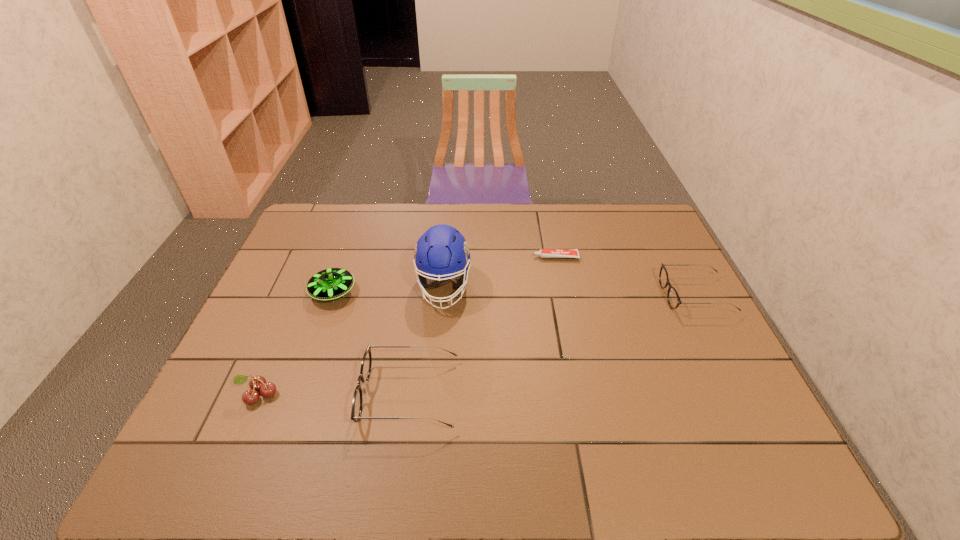
I want to click on spectacles present at the near edge, so click(x=366, y=364).

The image size is (960, 540). I want to click on cherry that is at the near edge, so click(257, 383).

What are the coordinates of `saucer located at the left edge` in the screenshot? It's located at (329, 284).

The height and width of the screenshot is (540, 960). Find the location of `cherry that is at the left edge`. cherry that is at the left edge is located at coordinates pos(257,383).

This screenshot has width=960, height=540. Identify the location of object at the right edge. (673, 299).

Locate an element on the screen. Image resolution: width=960 pixels, height=540 pixels. object positioned at the near left corner is located at coordinates (257, 383).

At what (x,y) coordinates should I click in order to perform the action: click on vacant space at the far edge of the desktop. Please return your answer as a coordinate pair (x, y). This screenshot has height=540, width=960. Looking at the image, I should click on (476, 219).

You are a GUI agent. You are given a task and a screenshot of the screen. Output one action in this format:
    pyautogui.click(x=<x>, y=<y>)
    Task: Click on the vacant space at the near edge of the desktop
    Image resolution: width=960 pixels, height=540 pixels.
    Given the screenshot: What is the action you would take?
    pyautogui.click(x=351, y=424)

Locate an element on the screen. free space at the left edge is located at coordinates (267, 292).

In the image, there is a desktop. Identify the location of vacant space at the right edge. (725, 388).